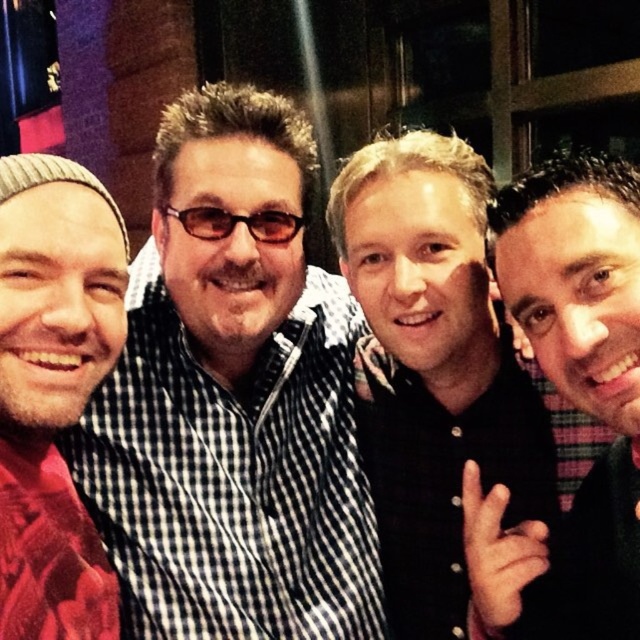
You are standing in a dimly lit indoor space with a group of people. You need to locate the black matte shirt at center. Based on the coordinates provided, where would you look to find it?

The black matte shirt at center is located at the coordinates point (433, 369).